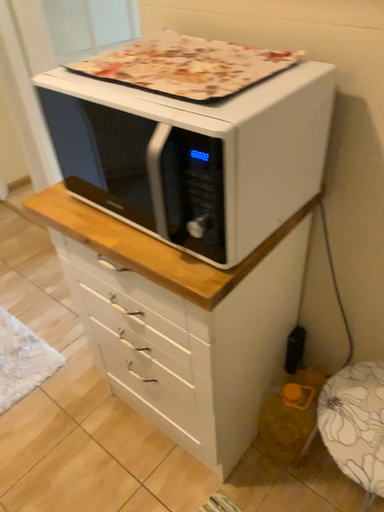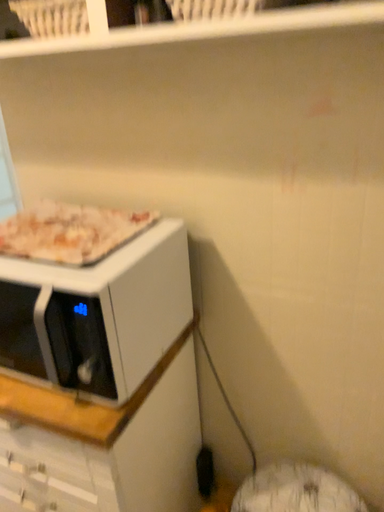
Question: How did the camera likely rotate when shooting the video?

Choices:
 (A) rotated right
 (B) rotated left

Answer: (A)